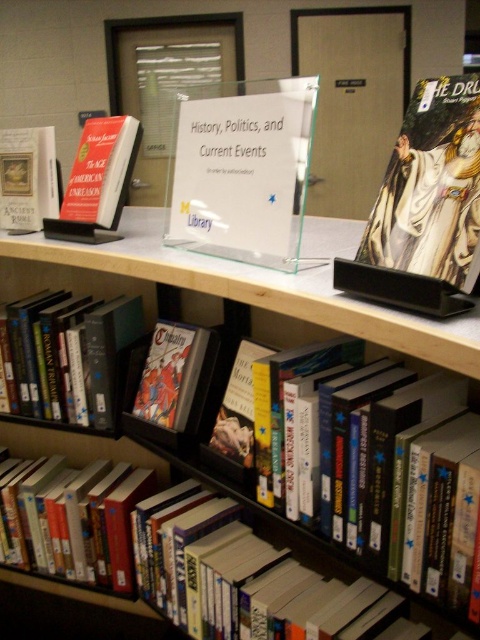
You are a librarian trying to place a new book on the shelf. You have two points marked on the shelf where you can place it. The points are labeled as point 1 at coordinates point (68, 330) and point 2 at coordinates point (173, 356). Which point is closer to you so that you can easily reach it without moving closer to the shelf?

Point (68, 330) is closer to you than point (173, 356), so you can easily reach it without moving closer to the shelf.

What are the coordinates of the hardcover comic book at upper right in the image?

The hardcover comic book at upper right is located at coordinates [424,208].

From the picture: You are a librarian trying to place a new book on the library bookshelf. You have two points marked on the shelf where you can place it. The first point is at coordinates point (228,252) and the second is at point (29,164). Which point is closer to you so that you can easily reach it?

Point (228,252) is closer to the viewer than point (29,164), so you can easily reach it.